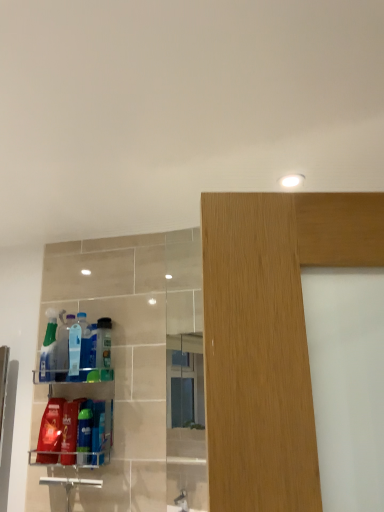
Question: Does blue glossy bottle at lower left, which appears as the 3th cleaning product when viewed from the right, appear on the left side of translucent plastic bottle at left, the 6th cleaning product from the right?

Choices:
 (A) no
 (B) yes

Answer: (A)

Question: Is blue glossy bottle at lower left, the 6th cleaning product in the left-to-right sequence, facing towards translucent plastic bottle at left, the 3th cleaning product when ordered from left to right?

Choices:
 (A) no
 (B) yes

Answer: (A)

Question: Does blue glossy bottle at lower left, which appears as the 3th cleaning product when viewed from the right, come in front of translucent plastic bottle at left, the 6th cleaning product from the right?

Choices:
 (A) no
 (B) yes

Answer: (B)

Question: Does blue glossy bottle at lower left, which appears as the 3th cleaning product when viewed from the right, have a larger size compared to translucent plastic bottle at left, the 3th cleaning product when ordered from left to right?

Choices:
 (A) no
 (B) yes

Answer: (A)

Question: From a real-world perspective, is blue glossy bottle at lower left, which appears as the 3th cleaning product when viewed from the right, below translucent plastic bottle at left, the 6th cleaning product from the right?

Choices:
 (A) yes
 (B) no

Answer: (A)

Question: From the image's perspective, is blue glossy bottle at lower left, which appears as the 3th cleaning product when viewed from the right, on top of translucent plastic bottle at left, the 6th cleaning product from the right?

Choices:
 (A) yes
 (B) no

Answer: (B)

Question: Would you say blue glossy bottle at lower left, which appears as the 3th cleaning product when viewed from the right, contains matte red plastic bottle at lower left, acting as the second cleaning product starting from the left?

Choices:
 (A) no
 (B) yes

Answer: (A)

Question: Does blue glossy bottle at lower left, the 6th cleaning product in the left-to-right sequence, have a smaller size compared to matte red plastic bottle at lower left, acting as the second cleaning product starting from the left?

Choices:
 (A) yes
 (B) no

Answer: (A)

Question: Can you confirm if blue glossy bottle at lower left, which appears as the 3th cleaning product when viewed from the right, is taller than matte red plastic bottle at lower left, acting as the second cleaning product starting from the left?

Choices:
 (A) yes
 (B) no

Answer: (B)

Question: From a real-world perspective, is blue glossy bottle at lower left, the 6th cleaning product in the left-to-right sequence, below matte red plastic bottle at lower left, acting as the second cleaning product starting from the left?

Choices:
 (A) no
 (B) yes

Answer: (B)

Question: Are blue glossy bottle at lower left, the 6th cleaning product in the left-to-right sequence, and matte red plastic bottle at lower left, acting as the 7th cleaning product starting from the right, making contact?

Choices:
 (A) yes
 (B) no

Answer: (B)

Question: Considering the relative sizes of blue glossy bottle at lower left, which appears as the 3th cleaning product when viewed from the right, and matte red plastic bottle at lower left, acting as the 7th cleaning product starting from the right, in the image provided, is blue glossy bottle at lower left, which appears as the 3th cleaning product when viewed from the right, bigger than matte red plastic bottle at lower left, acting as the 7th cleaning product starting from the right,?

Choices:
 (A) yes
 (B) no

Answer: (B)

Question: Does translucent plastic spray bottle at left, the 1th cleaning product viewed from the left, turn towards matte red plastic bottle at lower left, acting as the second cleaning product starting from the left?

Choices:
 (A) no
 (B) yes

Answer: (A)